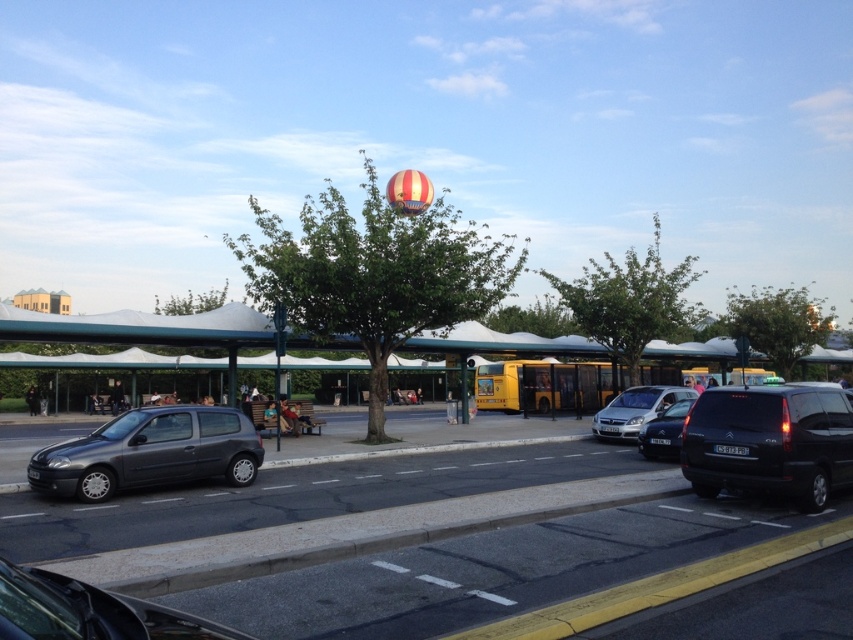
Which is below, metallic gray car at lower left or satin black car at center?

satin black car at center

Does point (90, 634) come closer to viewer compared to point (659, 449)?

Yes, it is in front of point (659, 449).

Is point (144, 628) closer to camera compared to point (639, 433)?

Yes, point (144, 628) is in front of point (639, 433).

The image size is (853, 640). Find the location of `metallic gray car at lower left`. metallic gray car at lower left is located at coordinates (88, 611).

How far apart are black matte van at right and metallic gray car at lower left?

black matte van at right is 8.86 meters away from metallic gray car at lower left.

Does black matte van at right have a lesser height compared to metallic gray car at lower left?

No, black matte van at right is not shorter than metallic gray car at lower left.

The height and width of the screenshot is (640, 853). What are the coordinates of `black matte van at right` in the screenshot? It's located at (769, 442).

This screenshot has width=853, height=640. In order to click on black matte van at right in this screenshot , I will do `click(769, 442)`.

Looking at this image, can you confirm if black matte van at right is smaller than matte black hatchback at left?

Yes, black matte van at right is smaller than matte black hatchback at left.

Who is more distant from viewer, (764, 435) or (122, 456)?

Point (122, 456)

At what (x,y) coordinates should I click in order to perform the action: click on black matte van at right. Please return your answer as a coordinate pair (x, y). Looking at the image, I should click on (769, 442).

Find the location of a particular element. This screenshot has width=853, height=640. black matte van at right is located at coordinates (769, 442).